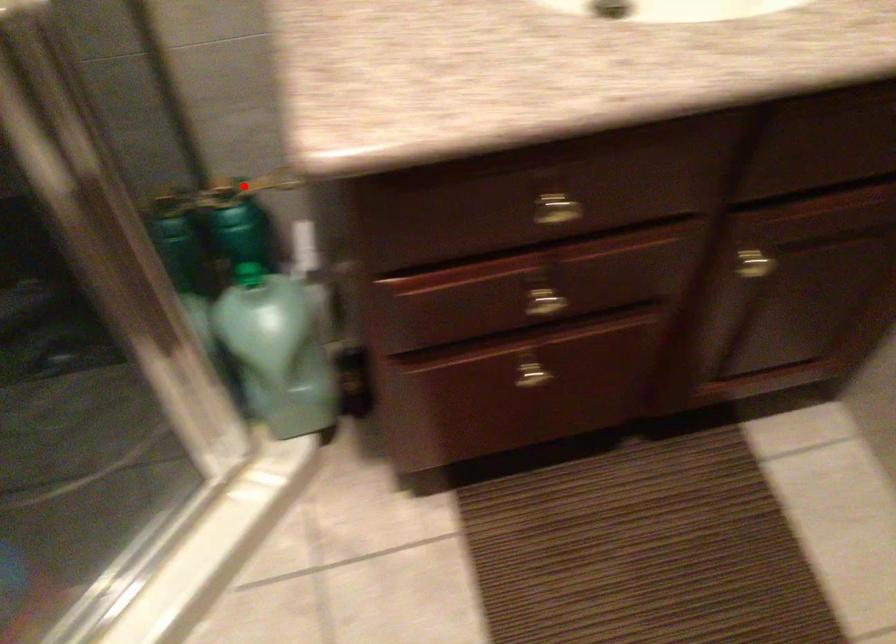
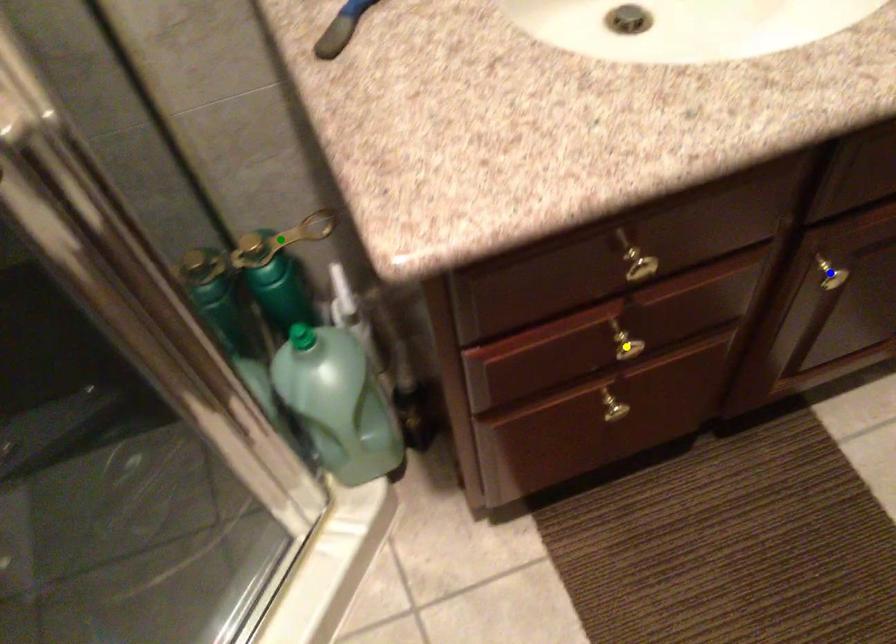
Question: I am providing you with two images of the same scene from different viewpoints. A red point is marked on the first image. You are given multiple points on the second image. Which point in image 2 is actually the same real-world point as the red point in image 1?

Choices:
 (A) yellow point
 (B) green point
 (C) blue point

Answer: (B)